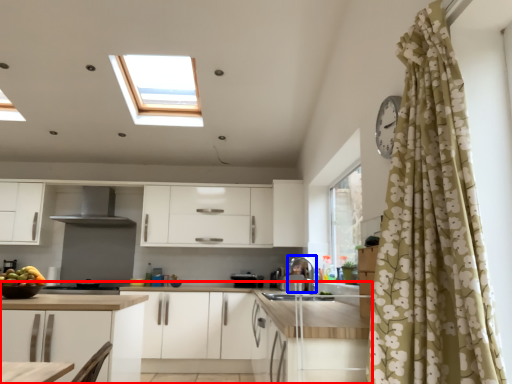
Question: Among these objects, which one is farthest to the camera, countertop (highlighted by a red box) or appliance (highlighted by a blue box)?

Choices:
 (A) countertop
 (B) appliance

Answer: (B)